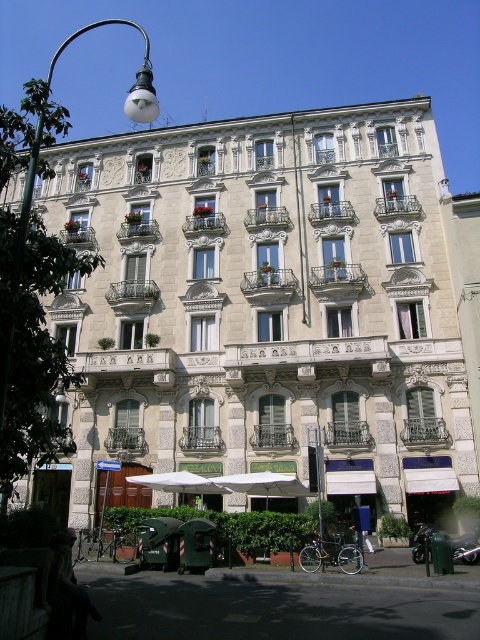
You are standing in front of a classical building. Based on the coordinates provided, where is the white stone building at center located in the image?

The white stone building at center is located at point (263, 312) in the image.

You are standing on the sidewalk in front of the building and want to take a photo of the white stone building at center. To avoid having the metallic streetlamp at left appear in your photo, should you position yourself to the left or right of the streetlamp?

You should position yourself to the right of the metallic streetlamp at left because the white stone building at center is located to the right of the streetlamp, so standing to the right would keep the streetlamp out of the frame.

You are standing at point (263,312) in the image of a classical building. What object is located exactly at your current position?

The white stone building at center is located exactly at point (263,312).